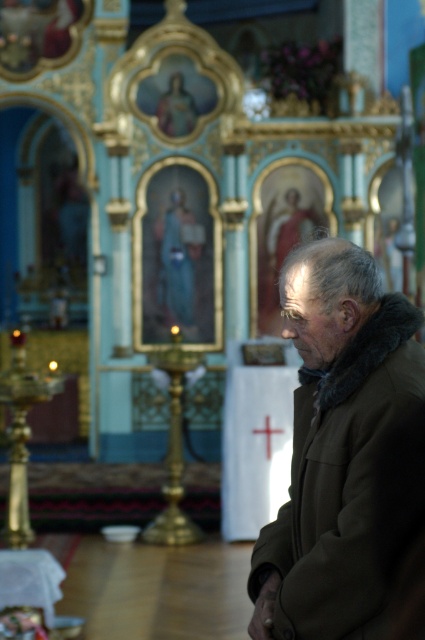
Question: Does brown fur-trimmed coat at center come in front of white wooden cross at center?

Choices:
 (A) yes
 (B) no

Answer: (A)

Question: Which point appears farthest from the camera in this image?

Choices:
 (A) (269, 435)
 (B) (323, 321)

Answer: (A)

Question: Can you confirm if brown fur-trimmed coat at center is positioned to the left of white wooden cross at center?

Choices:
 (A) yes
 (B) no

Answer: (B)

Question: Can you confirm if brown fur-trimmed coat at center is bigger than white wooden cross at center?

Choices:
 (A) yes
 (B) no

Answer: (A)